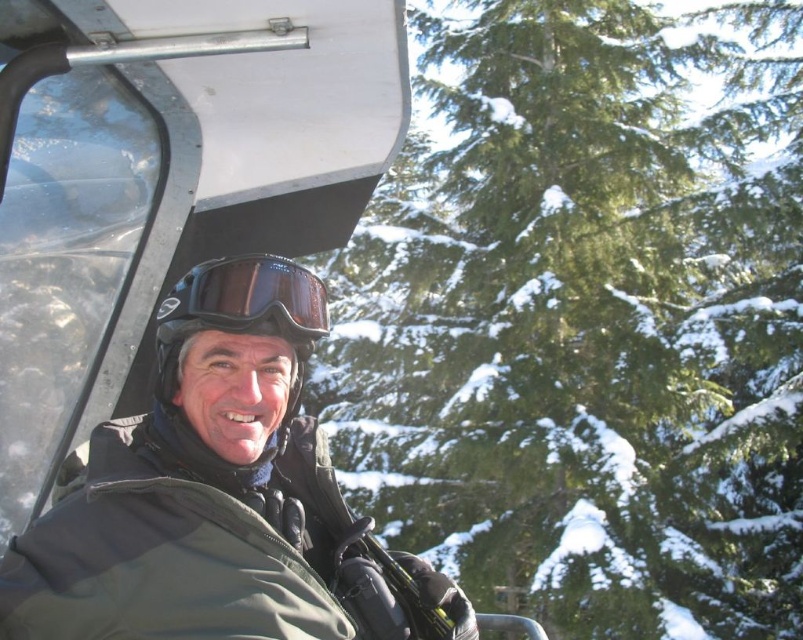
Does green textured pine at upper center appear under matte black goggles at center?

Actually, green textured pine at upper center is above matte black goggles at center.

Between green textured pine at upper center and matte black goggles at center, which one is positioned lower?

Positioned lower is matte black goggles at center.

Is point (609, 627) positioned after point (219, 289)?

Yes, it is.

Locate an element on the screen. The image size is (803, 640). green textured pine at upper center is located at coordinates (587, 317).